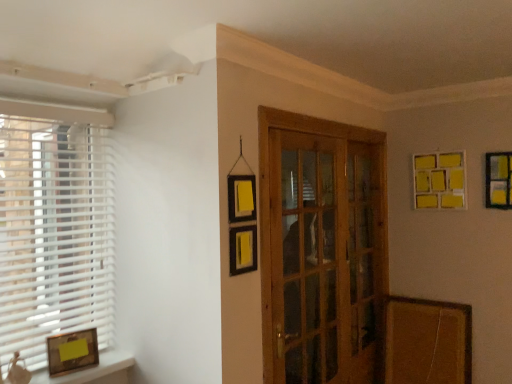
Question: Is wooden glass door at center completely or partially inside yellow matte picture frame at upper right, which is counted as the third picture frame, starting from the bottom?

Choices:
 (A) no
 (B) yes

Answer: (A)

Question: Can you confirm if yellow matte picture frame at upper right, positioned as the 2th picture frame in left-to-right order, is shorter than wooden glass door at center?

Choices:
 (A) yes
 (B) no

Answer: (A)

Question: Does yellow matte picture frame at upper right, which appears as the first picture frame when viewed from the back, have a lesser width compared to wooden glass door at center?

Choices:
 (A) yes
 (B) no

Answer: (A)

Question: Is yellow matte picture frame at upper right, positioned as the 2th picture frame in left-to-right order, behind wooden glass door at center?

Choices:
 (A) no
 (B) yes

Answer: (B)

Question: Is matte gold picture frame at lower left, arranged as the third picture frame when viewed from the top, wider or thinner than yellow matte picture frame at upper right, placed as the 3th picture frame when sorted from left to right?

Choices:
 (A) wide
 (B) thin

Answer: (A)

Question: From a real-world perspective, is matte gold picture frame at lower left, positioned as the first picture frame in left-to-right order, positioned above or below yellow matte picture frame at upper right, placed as the 3th picture frame when sorted from left to right?

Choices:
 (A) below
 (B) above

Answer: (A)

Question: Is matte gold picture frame at lower left, which is counted as the third picture frame, starting from the right, taller or shorter than yellow matte picture frame at upper right, which ranks as the first picture frame in right-to-left order?

Choices:
 (A) short
 (B) tall

Answer: (A)

Question: Based on their sizes in the image, would you say matte gold picture frame at lower left, the 1th picture frame in the front-to-back sequence, is bigger or smaller than yellow matte picture frame at upper right, the 2th picture frame when ordered from back to front?

Choices:
 (A) small
 (B) big

Answer: (A)

Question: From their relative heights in the image, would you say yellow matte picture frame at upper right, the 2th picture frame when ordered from back to front, is taller or shorter than matte gold picture frame at lower left, which is counted as the third picture frame, starting from the right?

Choices:
 (A) short
 (B) tall

Answer: (B)

Question: Do you think yellow matte picture frame at upper right, which ranks as the second picture frame in front-to-back order, is within matte gold picture frame at lower left, which is counted as the third picture frame, starting from the right, or outside of it?

Choices:
 (A) outside
 (B) inside

Answer: (A)

Question: Looking at the image, does yellow matte picture frame at upper right, marked as the 2th picture frame in a bottom-to-top arrangement, seem bigger or smaller compared to matte gold picture frame at lower left, which is counted as the third picture frame, starting from the right?

Choices:
 (A) small
 (B) big

Answer: (B)

Question: In terms of width, does yellow matte picture frame at upper right, acting as the 2th picture frame starting from the top, look wider or thinner when compared to matte gold picture frame at lower left, positioned as the first picture frame in left-to-right order?

Choices:
 (A) thin
 (B) wide

Answer: (A)

Question: From a real-world perspective, is wooden glass door at center above or below white plastic blinds at left?

Choices:
 (A) above
 (B) below

Answer: (B)

Question: From the image's perspective, relative to white plastic blinds at left, is wooden glass door at center above or below?

Choices:
 (A) below
 (B) above

Answer: (A)